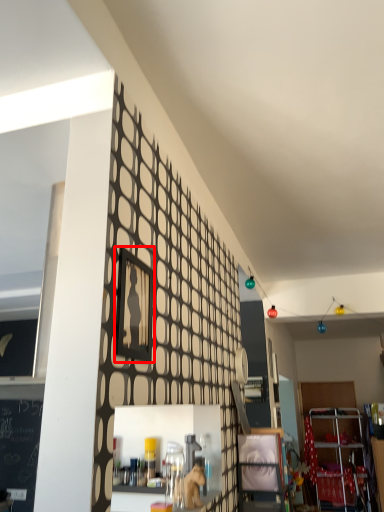
Question: Observing the image, what is the correct spatial positioning of picture frame (annotated by the red box) in reference to shelf?

Choices:
 (A) left
 (B) right

Answer: (A)